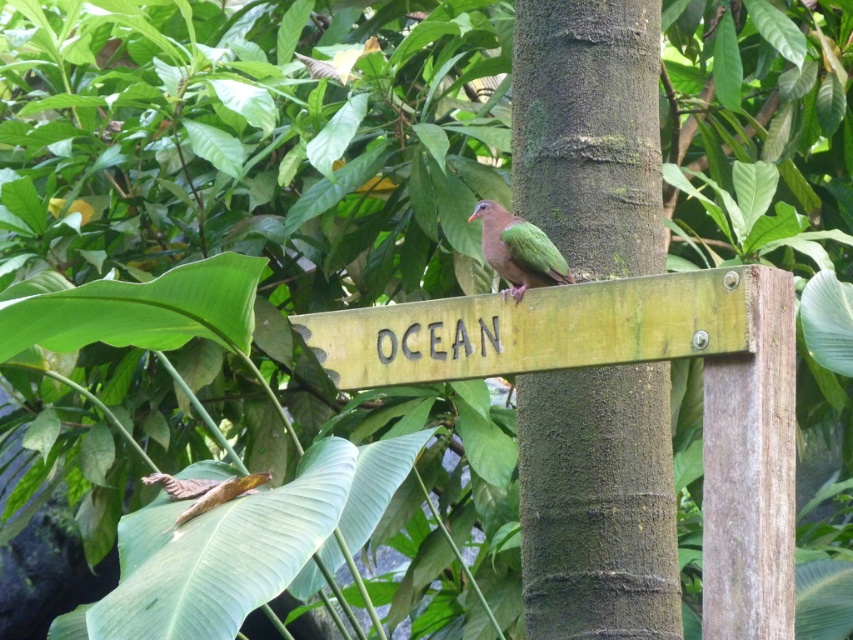
You are a birdwatcher observing the scene and want to take a photo of the green rough bark at center and the green wood sign at center. Which object should you focus on first to ensure both are in sharp focus?

You should focus on the green rough bark at center first because it is closer to you than the green wood sign at center, ensuring both will be in focus when using a shallow depth of field.

You are a photographer aiming to capture the green glossy bird at center and the green rough bark at center in a single frame. Based on their sizes, which object should you focus on first to ensure both are in focus?

The green rough bark at center is taller than the green glossy bird at center, so you should focus on the green rough bark at center first to ensure both are in focus.

You are a birdwatcher observing the green glossy bird at center perched on the green wood sign at center. Can you determine if the bird is taller than the sign?

The green wood sign at center has a greater height compared to the green glossy bird at center, so the bird is shorter than the sign.